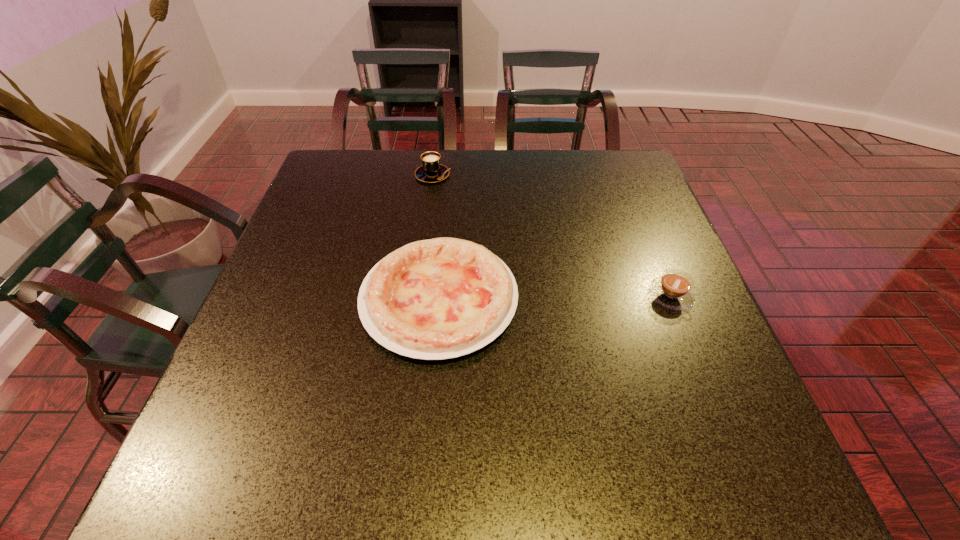
Image resolution: width=960 pixels, height=540 pixels. What are the coordinates of `the left cappuccino` in the screenshot? It's located at (431, 171).

Locate an element on the screen. This screenshot has height=540, width=960. the farther cappuccino is located at coordinates (431, 171).

Locate an element on the screen. Image resolution: width=960 pixels, height=540 pixels. pizza is located at coordinates (441, 298).

Find the location of a particular element. The image size is (960, 540). the right cappuccino is located at coordinates (674, 289).

Where is `the shorter cappuccino`? The height and width of the screenshot is (540, 960). the shorter cappuccino is located at coordinates (674, 289).

Where is `vacant area situated on the front of the farther cappuccino`? vacant area situated on the front of the farther cappuccino is located at coordinates (421, 256).

Where is `vacant space located on the front of the pizza`? The image size is (960, 540). vacant space located on the front of the pizza is located at coordinates 424,472.

I want to click on vacant region located on the back of the nearer cappuccino, so click(x=649, y=242).

This screenshot has height=540, width=960. What are the coordinates of `object positioned at the far edge` in the screenshot? It's located at (431, 171).

I want to click on object present at the right edge, so click(x=674, y=289).